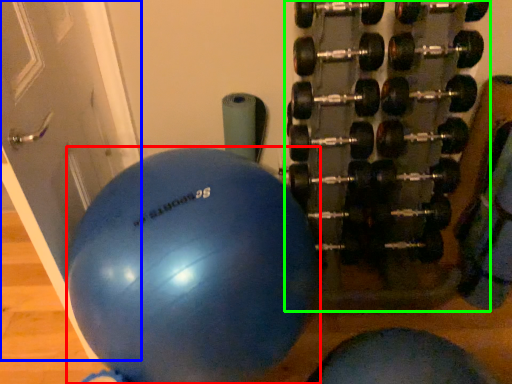
Question: Considering the real-world distances, which object is farthest from ball (highlighted by a red box)? door (highlighted by a blue box) or dumbbell (highlighted by a green box)?

Choices:
 (A) door
 (B) dumbbell

Answer: (B)